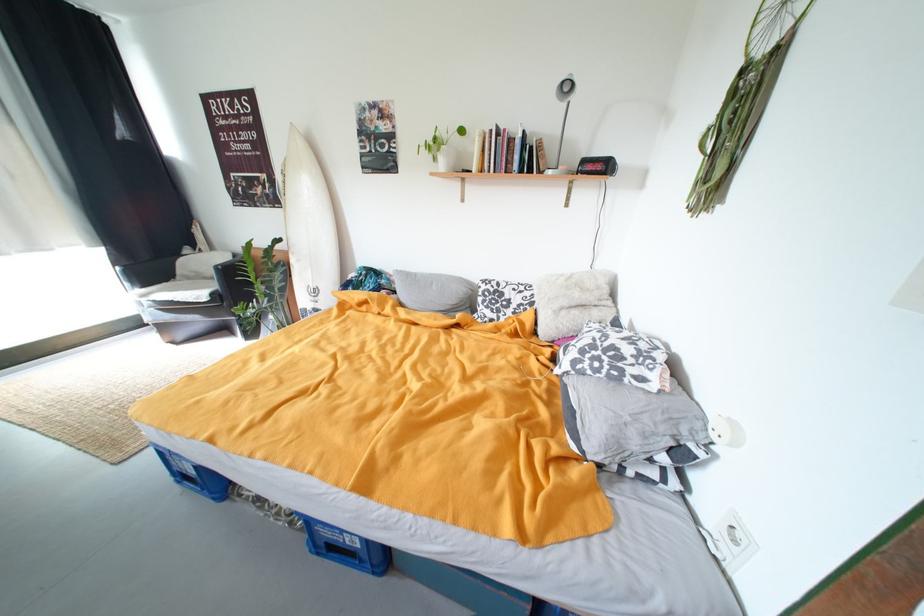
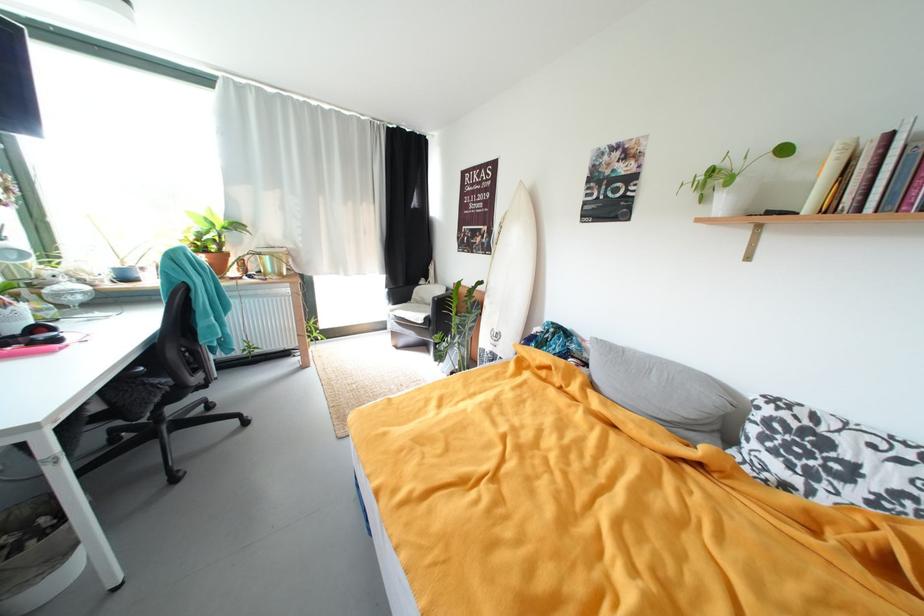
Where in the second image is the point corresponding to the point at 490,172 from the first image?

(837, 212)